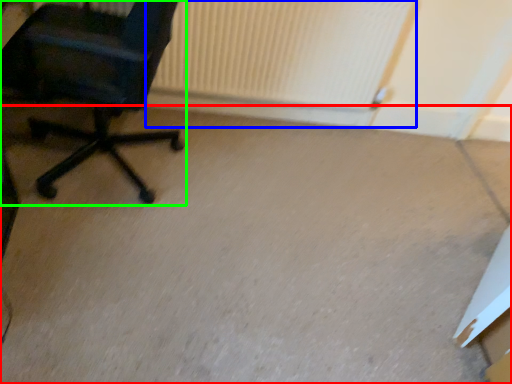
Question: Which object is the farthest from concrete (highlighted by a red box)? Choose among these: radiator (highlighted by a blue box) or chair (highlighted by a green box).

Choices:
 (A) radiator
 (B) chair

Answer: (B)